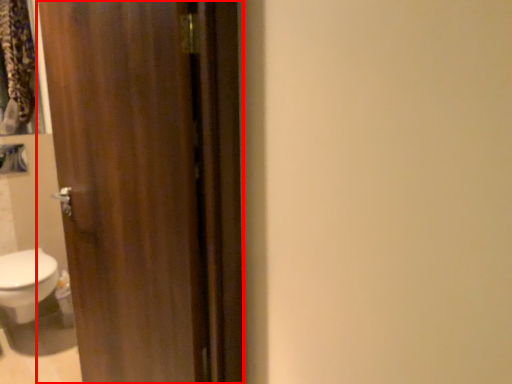
Question: Considering the relative positions of door (annotated by the red box) and bidet in the image provided, where is door (annotated by the red box) located with respect to the staircase?

Choices:
 (A) left
 (B) right

Answer: (B)